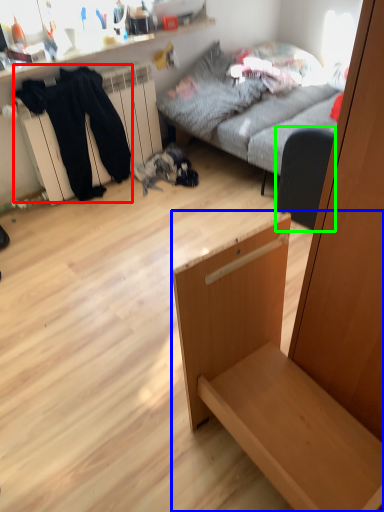
Question: Based on their relative distances, which object is nearer to clothing (highlighted by a red box)? Choose from furniture (highlighted by a blue box) and armchair (highlighted by a green box).

Choices:
 (A) furniture
 (B) armchair

Answer: (B)